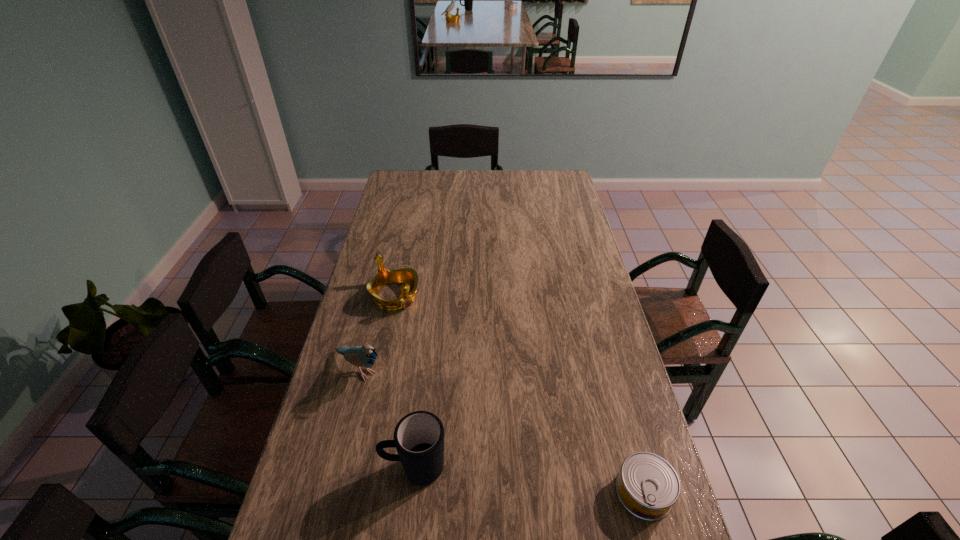
This screenshot has height=540, width=960. I want to click on mug, so click(x=419, y=436).

Find the location of a particular element. the shortest object is located at coordinates (647, 486).

Locate an element on the screen. can is located at coordinates (x=647, y=486).

Where is `the third nearest object`? This screenshot has width=960, height=540. the third nearest object is located at coordinates (361, 356).

You are a GUI agent. You are given a task and a screenshot of the screen. Output one action in this format:
    pyautogui.click(x=<x>, y=<y>)
    Task: Click on the farthest object
    
    Given the screenshot: What is the action you would take?
    pyautogui.click(x=408, y=276)

What are the coordinates of `the third tallest object` in the screenshot? It's located at (408, 276).

Where is `vacant region located 0.160m on the side of the mug with the handle`? vacant region located 0.160m on the side of the mug with the handle is located at coordinates (318, 468).

The image size is (960, 540). I want to click on vacant space positioned on the side of the mug with the handle, so click(342, 468).

Find the location of `vacant space located on the side of the mug with the handle`. vacant space located on the side of the mug with the handle is located at coordinates (333, 468).

Where is `vacant point located on the back of the rightmost object`? vacant point located on the back of the rightmost object is located at coordinates (625, 422).